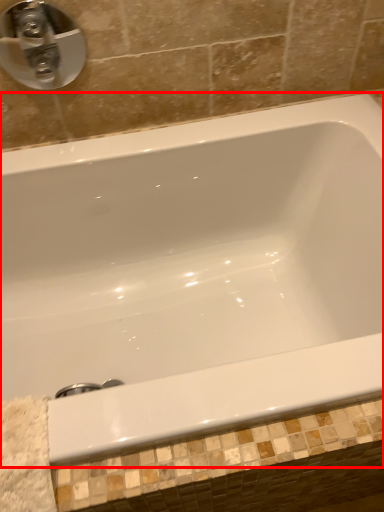
Question: From the image, what is the correct spatial relationship of bathtub (annotated by the red box) in relation to tap?

Choices:
 (A) right
 (B) left

Answer: (A)